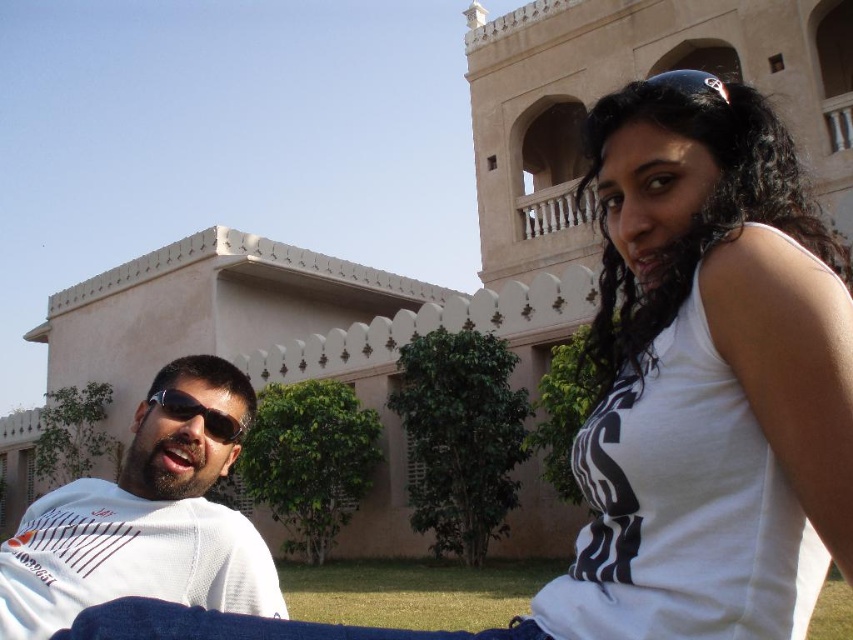
Is white fabric shirt at left shorter than matte black sunglasses at left?

Incorrect, white fabric shirt at left's height does not fall short of matte black sunglasses at left's.

Does white fabric shirt at left appear on the right side of matte black sunglasses at left?

Incorrect, white fabric shirt at left is not on the right side of matte black sunglasses at left.

Is point (19, 536) positioned behind point (187, 404)?

No.

Identify the location of white fabric shirt at left. The height and width of the screenshot is (640, 853). (148, 516).

Find the location of a particular element. The height and width of the screenshot is (640, 853). white cotton tank top at upper right is located at coordinates (706, 381).

Which is more to the right, white cotton tank top at upper right or matte black sunglasses at left?

white cotton tank top at upper right

What do you see at coordinates (706, 381) in the screenshot?
I see `white cotton tank top at upper right` at bounding box center [706, 381].

Locate an element on the screen. The image size is (853, 640). white cotton tank top at upper right is located at coordinates (706, 381).

You are a GUI agent. You are given a task and a screenshot of the screen. Output one action in this format:
    pyautogui.click(x=<x>, y=<y>)
    Task: Click on the white cotton tank top at upper right
    
    Given the screenshot: What is the action you would take?
    pyautogui.click(x=706, y=381)

Can you confirm if white cotton tank top at upper right is thinner than white fabric shirt at left?

Indeed, white cotton tank top at upper right has a lesser width compared to white fabric shirt at left.

Is point (849, 374) closer to camera compared to point (45, 588)?

Yes, point (849, 374) is closer to viewer.

This screenshot has width=853, height=640. Identify the location of white cotton tank top at upper right. (706, 381).